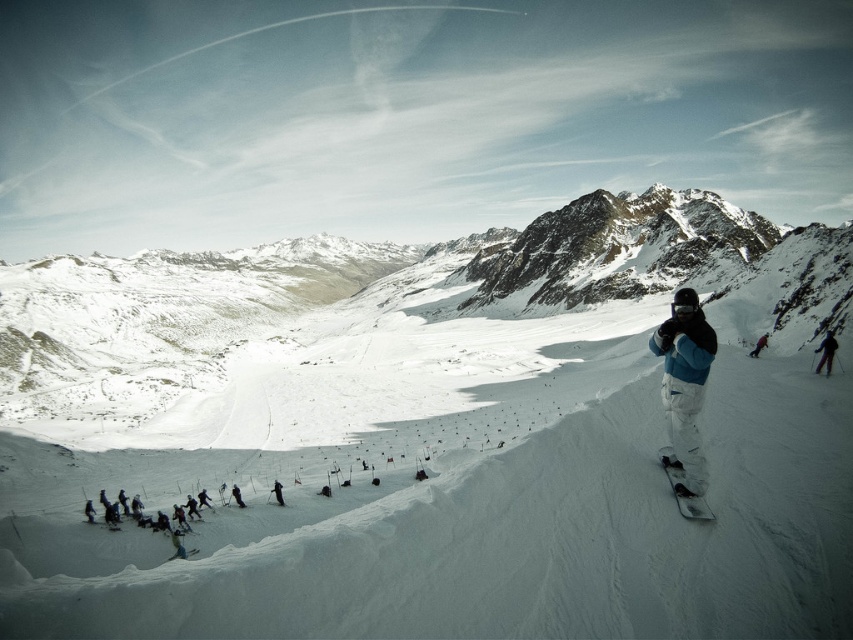
Question: Is white matte snowboard at center smaller than blue denim pants at lower left?

Choices:
 (A) no
 (B) yes

Answer: (A)

Question: Which object appears farthest from the camera in this image?

Choices:
 (A) black ski suit at center
 (B) white matte snowboard at center
 (C) shiny black snowboard at lower right

Answer: (A)

Question: Observing the image, what is the correct spatial positioning of black matte snowboarder at center in reference to black ski suit at center?

Choices:
 (A) left
 (B) right

Answer: (B)

Question: Which object is closer to the camera taking this photo?

Choices:
 (A) black ski suit at center
 (B) red snowboarder at center
 (C) blue denim pants at lower left

Answer: (C)

Question: Which object is positioned farthest from the red snowboarder at center?

Choices:
 (A) black matte snowboarder at center
 (B) blue denim pants at lower left
 (C) black ski suit at center
 (D) shiny black snowboard at lower right

Answer: (B)

Question: Does white matte snowboard at center have a lesser width compared to black matte snowboarder at right?

Choices:
 (A) yes
 (B) no

Answer: (B)